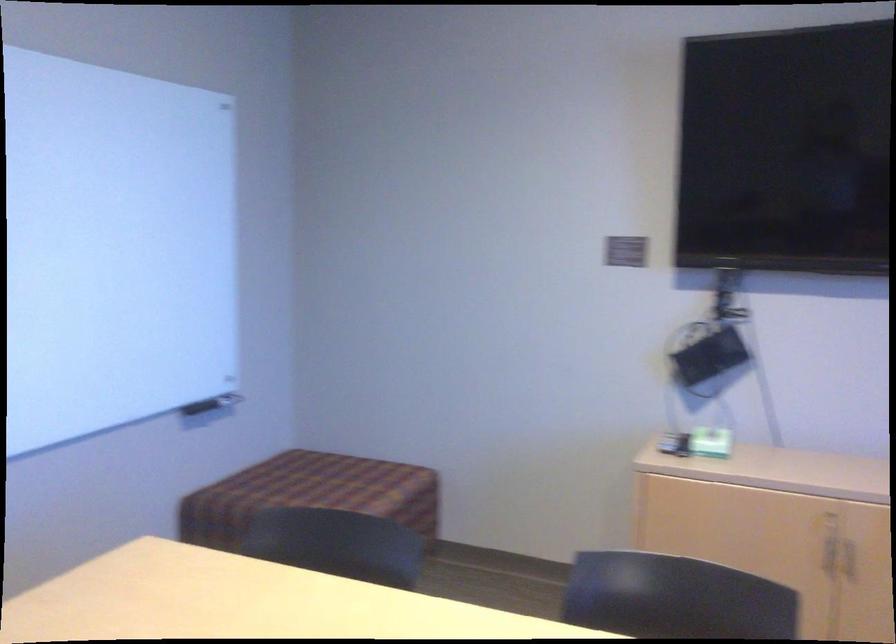
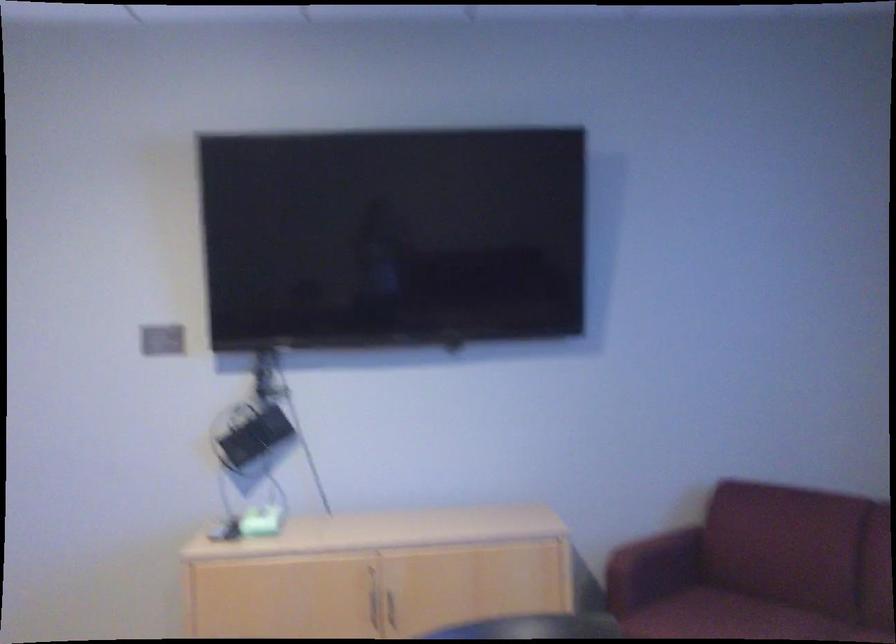
Which direction would the cameraman need to move to produce the second image?

The cameraman walked toward right, backward.